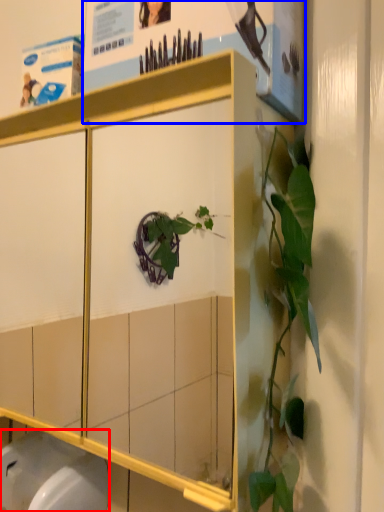
Question: Which object is further to the camera taking this photo, toilet bowl (highlighted by a red box) or poster page (highlighted by a blue box)?

Choices:
 (A) toilet bowl
 (B) poster page

Answer: (A)